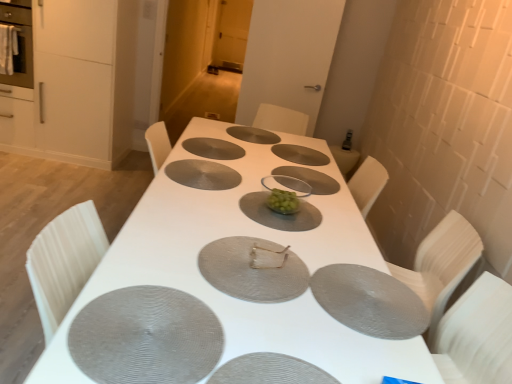
At what (x,y) coordinates should I click in order to perform the action: click on free space behind metallic silver pizza pan at center, positioned as the 5th pizza pan in back-to-front order. Please return your answer as a coordinate pair (x, y). Looking at the image, I should click on (250, 218).